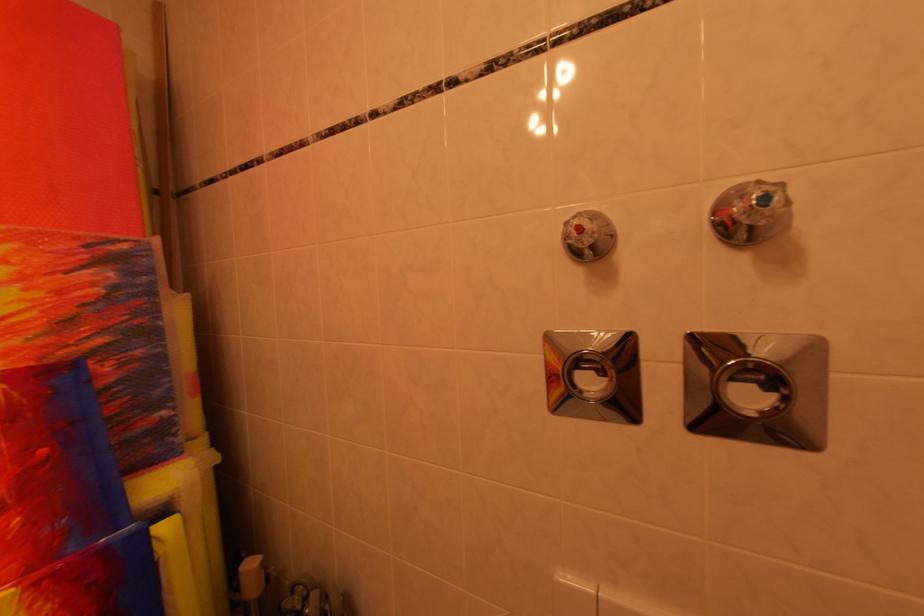
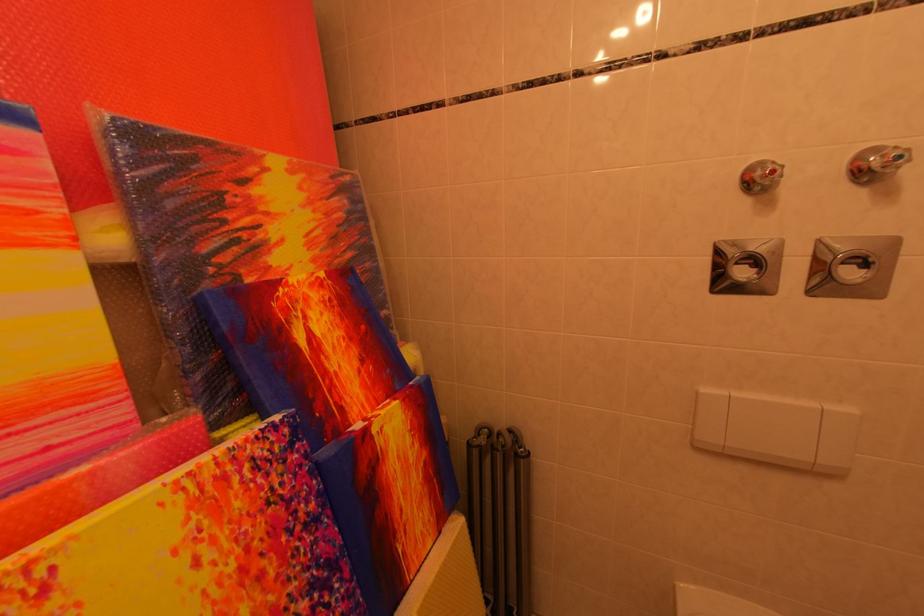
The point at (773, 201) is marked in the first image. Where is the corresponding point in the second image?

(907, 161)